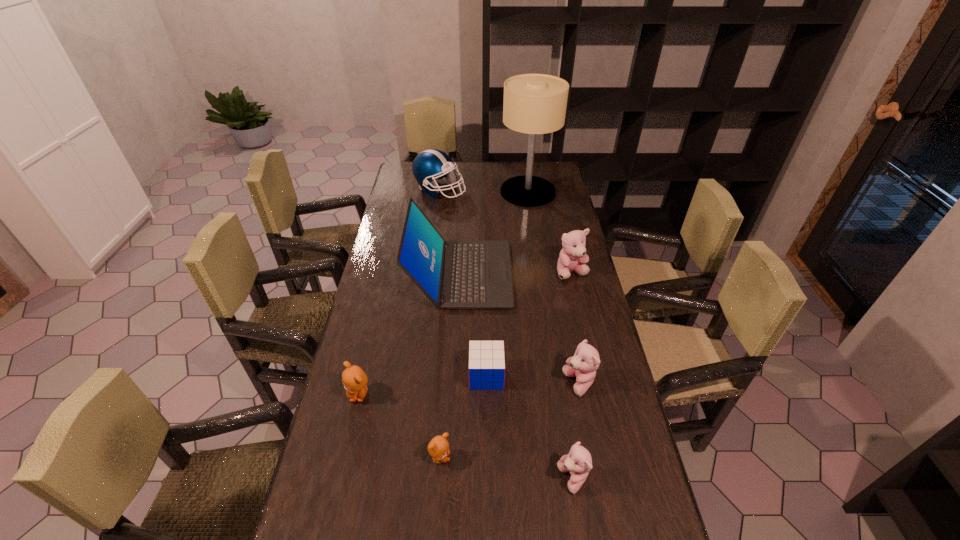
Where is `free region located 0.390m at the face of the fourth shortest teddy bear`? The image size is (960, 540). free region located 0.390m at the face of the fourth shortest teddy bear is located at coordinates (425, 384).

The width and height of the screenshot is (960, 540). I want to click on vacant space located 0.110m on the face of the farther brown teddy bear, so click(348, 443).

The width and height of the screenshot is (960, 540). What are the coordinates of `free region located at the face of the nearest pink teddy bear` in the screenshot? It's located at (487, 479).

At what (x,y) coordinates should I click in order to perform the action: click on free space located 0.170m at the face of the nearest pink teddy bear. Please return your answer as a coordinate pair (x, y). Looking at the image, I should click on (487, 479).

The image size is (960, 540). What are the coordinates of `vacant space located at the face of the nearest pink teddy bear` in the screenshot? It's located at (432, 479).

Where is `blank space located on the right of the cube`? The height and width of the screenshot is (540, 960). blank space located on the right of the cube is located at coordinates (528, 375).

Find the location of a particular element. Image resolution: width=960 pixels, height=540 pixels. vacant space located 0.360m on the face of the smaller brown teddy bear is located at coordinates pyautogui.click(x=596, y=458).

Where is `table lamp present at the far edge`? This screenshot has height=540, width=960. table lamp present at the far edge is located at coordinates (534, 104).

The height and width of the screenshot is (540, 960). In order to click on football helmet that is at the far edge in this screenshot , I will do `click(430, 165)`.

At what (x,y) coordinates should I click in order to perform the action: click on laptop computer present at the left edge. Please return your answer as a coordinate pair (x, y). Looking at the image, I should click on (456, 274).